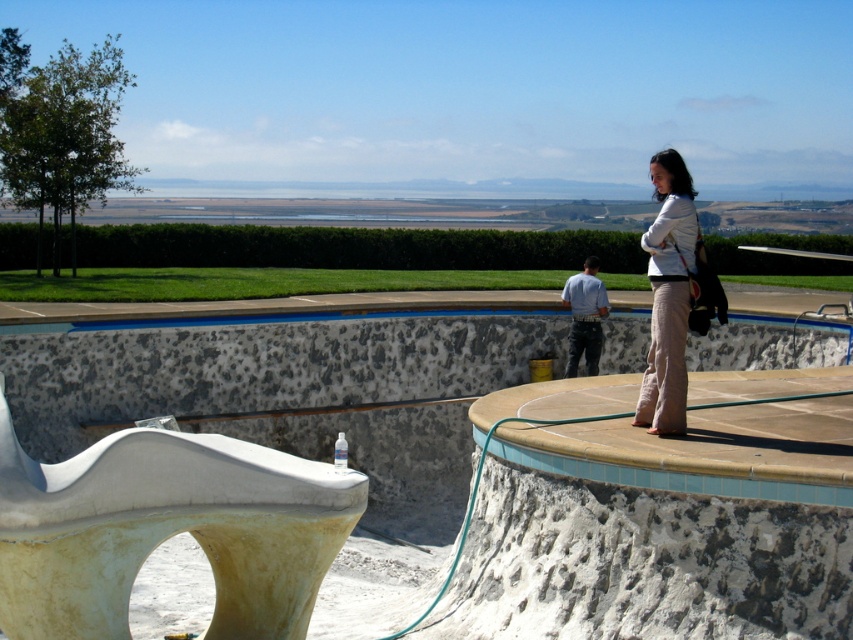
You are a contractor assessing the pool area. You notice the white concrete sculpture at lower left and the blue cotton shirt at center. Which object takes up more space in the scene?

The white concrete sculpture at lower left is bigger than the blue cotton shirt at center, so it takes up more space in the scene.

You are standing at the center of the pool area and need to locate the white concrete sculpture at lower left. According to the coordinates provided, in which direction should you move to find it?

The white concrete sculpture at lower left is located at coordinates point [166,531], which means it is positioned towards the lower left direction from your current position at the center. Move towards the lower left direction to find it.

You are a contractor working on an outdoor pool area. You see the white concrete sculpture at lower left and the blue cotton shirt at center. Which object is positioned lower in the scene?

The white concrete sculpture at lower left is positioned lower than the blue cotton shirt at center.